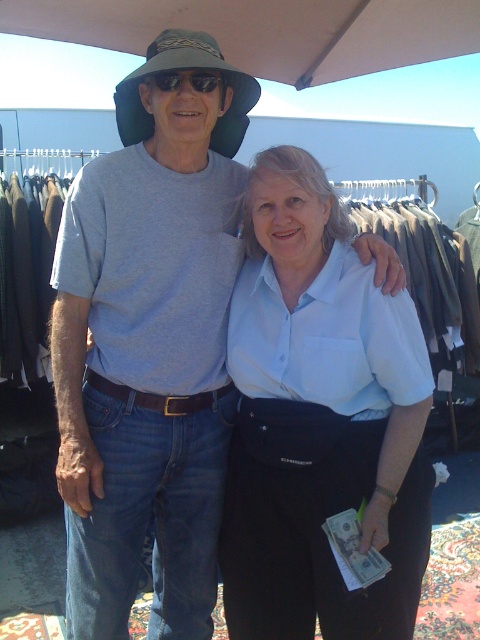
Question: Which point is farther to the camera?

Choices:
 (A) green fabric hat at upper center
 (B) matte black sunglasses at upper center

Answer: (B)

Question: Is green fabric hat at upper center behind matte black sunglasses at upper center?

Choices:
 (A) no
 (B) yes

Answer: (A)

Question: Does green fabric hat at upper center have a lesser width compared to matte black sunglasses at upper center?

Choices:
 (A) no
 (B) yes

Answer: (A)

Question: Which of the following is the closest to the observer?

Choices:
 (A) green fabric hat at upper center
 (B) white cotton blouse at center

Answer: (A)

Question: Which of the following is the farthest from the observer?

Choices:
 (A) white cotton blouse at center
 (B) green fabric hat at upper center
 (C) matte black sunglasses at upper center

Answer: (A)

Question: Can you confirm if white cotton blouse at center is positioned to the right of matte black sunglasses at upper center?

Choices:
 (A) yes
 (B) no

Answer: (A)